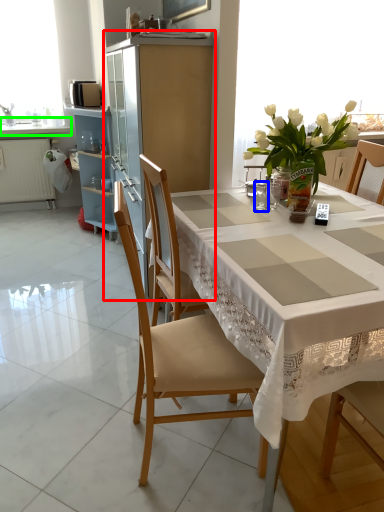
Question: Which object is the farthest from cabinetry (highlighted by a red box)? Choose among these: tableware (highlighted by a blue box) or countertop (highlighted by a green box).

Choices:
 (A) tableware
 (B) countertop

Answer: (B)